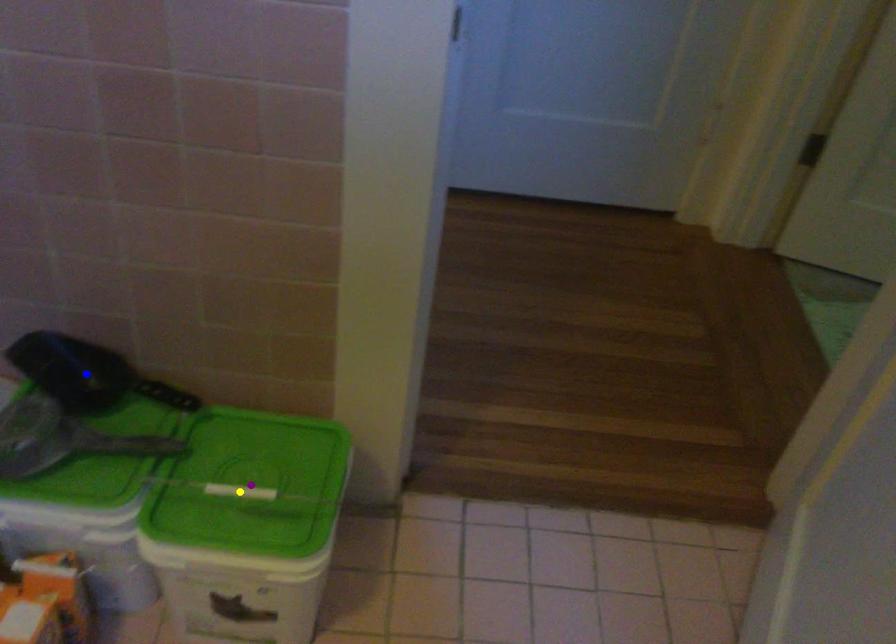
Order these from nearest to farthest:
yellow point
blue point
purple point

yellow point, purple point, blue point